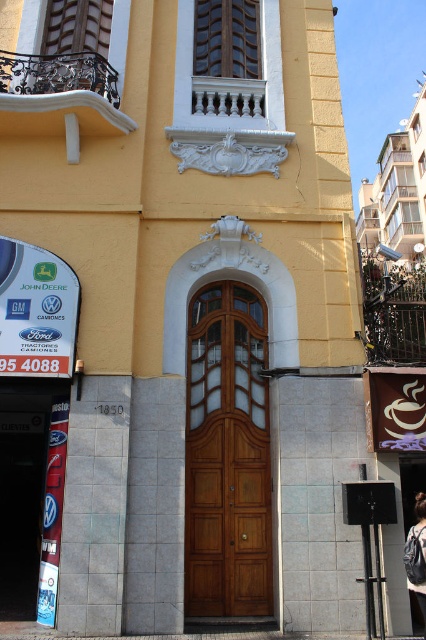
You are standing in front of the building and want to locate two points marked on the facade. The first point is at coordinates point [227,412] and the second at point [409,579]. Which point is closer to the viewer?

Point [409,579] is closer to the viewer because it is in front of point [227,412].

You are a painter who needs to decide whether to bring a ladder or a stool for a job. You see the wooden door at center and the denim jacket at lower right in the scene. Which object requires a taller piece of equipment to reach its top?

The wooden door at center requires a taller piece of equipment because it has a greater height compared to the denim jacket at lower right.